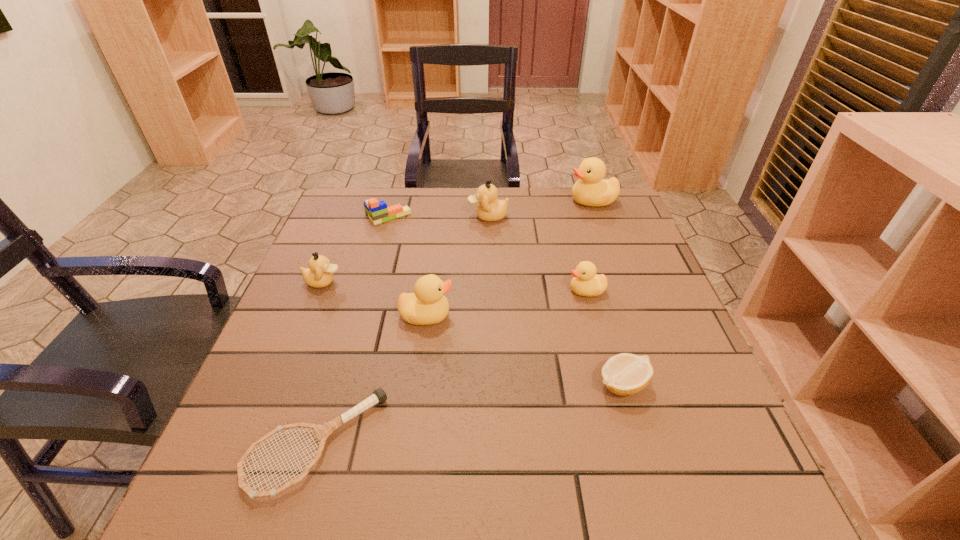
I want to click on vacant space that satisfies the following two spatial constraints: 1. on the back side of the lemon; 2. on the face of the fourth duckling from right to left, so click(602, 316).